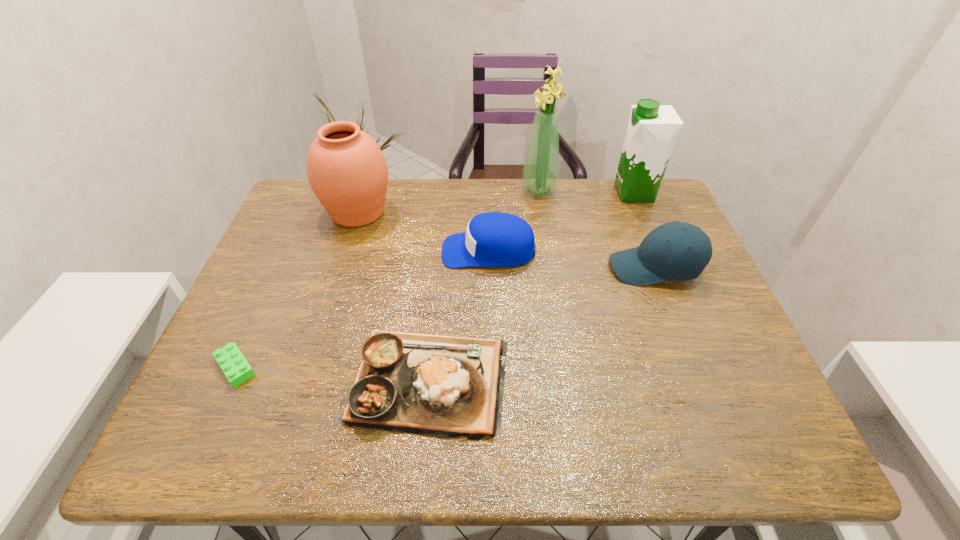
Identify the location of soya milk positioned at the right edge. (652, 130).

Find the location of a particular element. The height and width of the screenshot is (540, 960). baseball cap that is at the right edge is located at coordinates (676, 250).

This screenshot has height=540, width=960. I want to click on object that is at the far left corner, so click(347, 171).

You are a GUI agent. You are given a task and a screenshot of the screen. Output one action in this format:
    pyautogui.click(x=<x>, y=<y>)
    Task: Click on the object present at the far right corner
    The width and height of the screenshot is (960, 540).
    Given the screenshot: What is the action you would take?
    pyautogui.click(x=652, y=130)

I want to click on vacant space at the far edge of the desktop, so click(x=489, y=180).

You are a GUI agent. You are given a task and a screenshot of the screen. Output one action in this format:
    pyautogui.click(x=<x>, y=<y>)
    Task: Click on the free space at the left edge of the desktop
    
    Given the screenshot: What is the action you would take?
    pyautogui.click(x=252, y=386)

Identify the location of vacant space at the near right corner of the desktop. The height and width of the screenshot is (540, 960). (704, 442).

The width and height of the screenshot is (960, 540). Identify the location of free area in between the taller baseball cap and the soya milk. (644, 231).

The width and height of the screenshot is (960, 540). Find the location of `free space between the right baseball cap and the bouquet`. free space between the right baseball cap and the bouquet is located at coordinates (596, 229).

This screenshot has width=960, height=540. I want to click on free space between the bouquet and the urn, so click(448, 201).